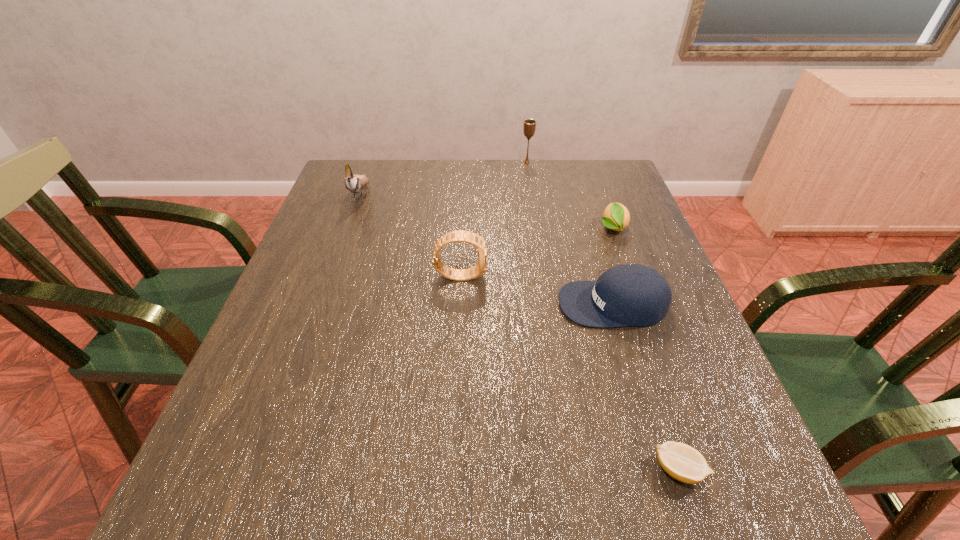
Where is `vacant region between the chalice and the bird`? Image resolution: width=960 pixels, height=540 pixels. vacant region between the chalice and the bird is located at coordinates (444, 178).

At what (x,y) coordinates should I click in order to perform the action: click on object that is the second closest one to the bird. Please return your answer as a coordinate pair (x, y). This screenshot has height=540, width=960. Looking at the image, I should click on (529, 127).

Image resolution: width=960 pixels, height=540 pixels. Find the location of `object that is the fifth closest to the third object from left to right`. object that is the fifth closest to the third object from left to right is located at coordinates (682, 462).

The image size is (960, 540). Identify the location of free spot that satisfies the following two spatial constraints: 1. with leaves positioned above the second shortest object; 2. on the face of the second object from left to right. (630, 275).

Locate an element on the screen. The height and width of the screenshot is (540, 960). vacant region that satisfies the following two spatial constraints: 1. on the face of the watch; 2. on the right side of the shorter lemon is located at coordinates (452, 470).